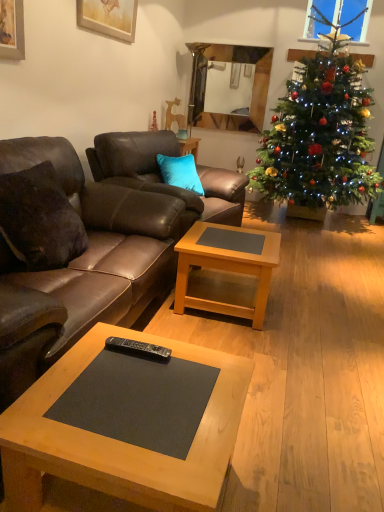
Question: From the image's perspective, is brown leather couch at center, positioned as the 2th studio couch in front-to-back order, beneath wooden matte coffee table at center, acting as the second coffee table starting from the back?

Choices:
 (A) yes
 (B) no

Answer: (B)

Question: Is brown leather couch at center, positioned as the 2th studio couch in front-to-back order, shorter than wooden matte coffee table at center, acting as the second coffee table starting from the back?

Choices:
 (A) no
 (B) yes

Answer: (A)

Question: Is brown leather couch at center, the 1th studio couch when ordered from back to front, not near wooden matte coffee table at center, placed as the 1th coffee table when sorted from front to back?

Choices:
 (A) yes
 (B) no

Answer: (A)

Question: Is brown leather couch at center, positioned as the 2th studio couch in front-to-back order, at the left side of wooden matte coffee table at center, acting as the second coffee table starting from the back?

Choices:
 (A) yes
 (B) no

Answer: (A)

Question: Is brown leather couch at center, the 1th studio couch when ordered from back to front, closer to camera compared to wooden matte coffee table at center, placed as the 1th coffee table when sorted from front to back?

Choices:
 (A) no
 (B) yes

Answer: (A)

Question: From a real-world perspective, is glossy wood mirror at upper center physically located above or below wooden matte coffee table at center, placed as the 1th coffee table when sorted from front to back?

Choices:
 (A) above
 (B) below

Answer: (A)

Question: Is glossy wood mirror at upper center wider or thinner than wooden matte coffee table at center, placed as the 1th coffee table when sorted from front to back?

Choices:
 (A) wide
 (B) thin

Answer: (B)

Question: Based on their sizes in the image, would you say glossy wood mirror at upper center is bigger or smaller than wooden matte coffee table at center, acting as the second coffee table starting from the back?

Choices:
 (A) big
 (B) small

Answer: (B)

Question: Is glossy wood mirror at upper center inside or outside of wooden matte coffee table at center, placed as the 1th coffee table when sorted from front to back?

Choices:
 (A) outside
 (B) inside

Answer: (A)

Question: In terms of width, does green matte christmas tree at right look wider or thinner when compared to glossy wood mirror at upper center?

Choices:
 (A) thin
 (B) wide

Answer: (B)

Question: From the image's perspective, is green matte christmas tree at right positioned above or below glossy wood mirror at upper center?

Choices:
 (A) above
 (B) below

Answer: (B)

Question: In terms of height, does green matte christmas tree at right look taller or shorter compared to glossy wood mirror at upper center?

Choices:
 (A) tall
 (B) short

Answer: (A)

Question: Is green matte christmas tree at right to the left or to the right of glossy wood mirror at upper center in the image?

Choices:
 (A) left
 (B) right

Answer: (B)

Question: Considering the positions of brown leather couch at left, which is the 1th studio couch in front-to-back order, and green matte christmas tree at right in the image, is brown leather couch at left, which is the 1th studio couch in front-to-back order, wider or thinner than green matte christmas tree at right?

Choices:
 (A) thin
 (B) wide

Answer: (A)

Question: From their relative heights in the image, would you say brown leather couch at left, which is counted as the 2th studio couch, starting from the back, is taller or shorter than green matte christmas tree at right?

Choices:
 (A) tall
 (B) short

Answer: (B)